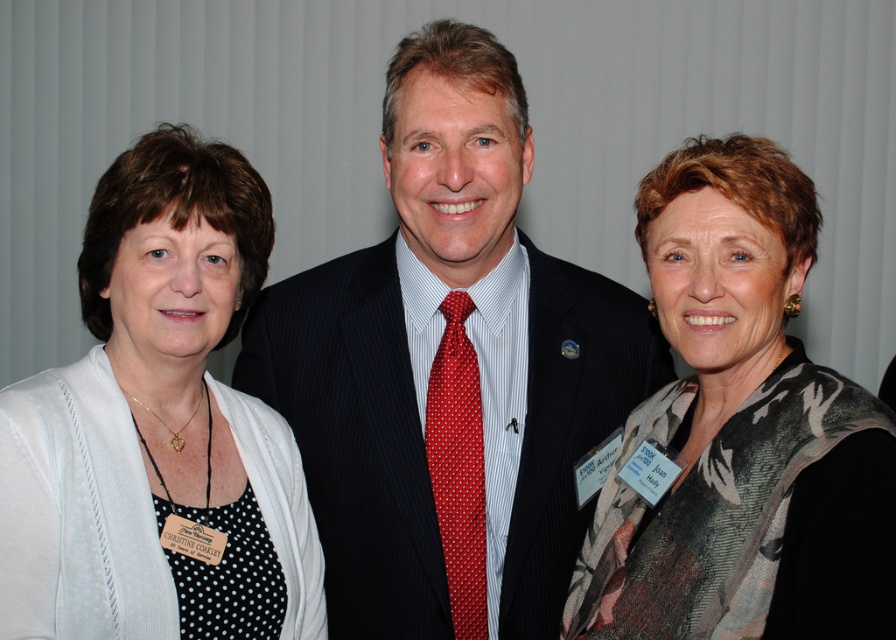
Question: Which point is farther from the camera taking this photo?

Choices:
 (A) (462, 380)
 (B) (114, 310)

Answer: (A)

Question: Does white knit cardigan at left appear on the left side of floral scarf at center?

Choices:
 (A) yes
 (B) no

Answer: (A)

Question: Which point is closer to the camera taking this photo?

Choices:
 (A) (420, 92)
 (B) (480, 630)
 (C) (855, 442)

Answer: (C)

Question: Is floral scarf at center above red dotted tie at center?

Choices:
 (A) yes
 (B) no

Answer: (A)

Question: Among these points, which one is nearest to the camera?

Choices:
 (A) (438, 532)
 (B) (378, 499)
 (C) (199, 492)
 (D) (720, 465)

Answer: (D)

Question: Where is floral scarf at center located in relation to red dotted tie at center in the image?

Choices:
 (A) left
 (B) right

Answer: (B)